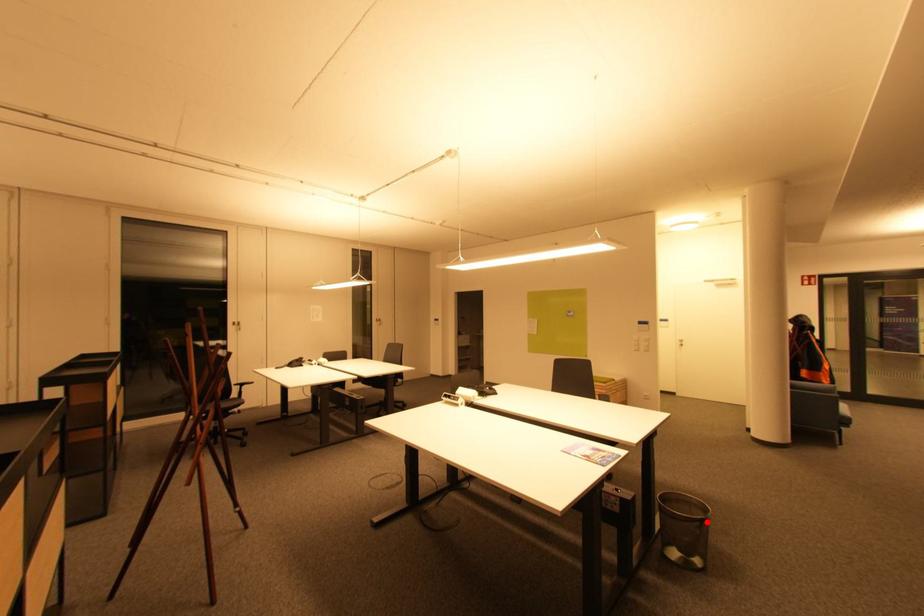
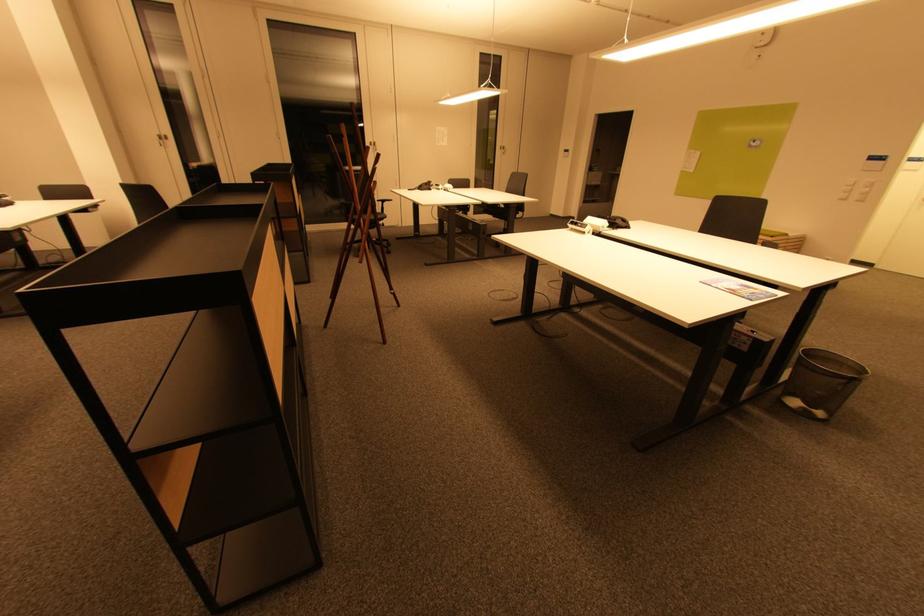
Where in the second image is the point corresponding to the highlighted location from the first image?

(859, 381)